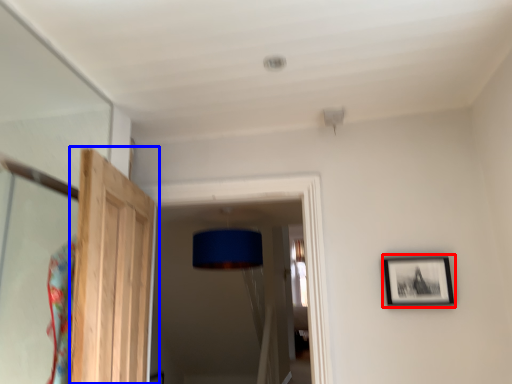
Question: Which object appears closest to the camera in this image, picture frame (highlighted by a red box) or door (highlighted by a blue box)?

Choices:
 (A) picture frame
 (B) door

Answer: (B)